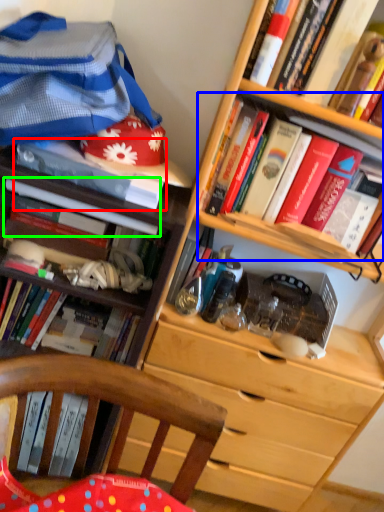
Question: Considering the real-world distances, which object is farthest from book (highlighted by a red box)? book (highlighted by a blue box) or book (highlighted by a green box)?

Choices:
 (A) book
 (B) book

Answer: (A)